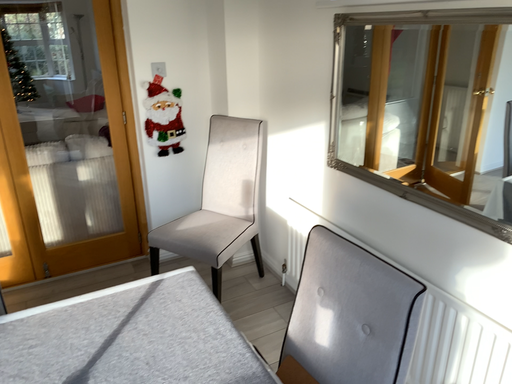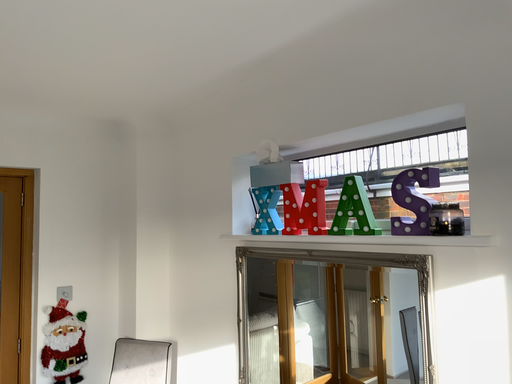
Question: Which way did the camera rotate in the video?

Choices:
 (A) rotated right
 (B) rotated left

Answer: (A)